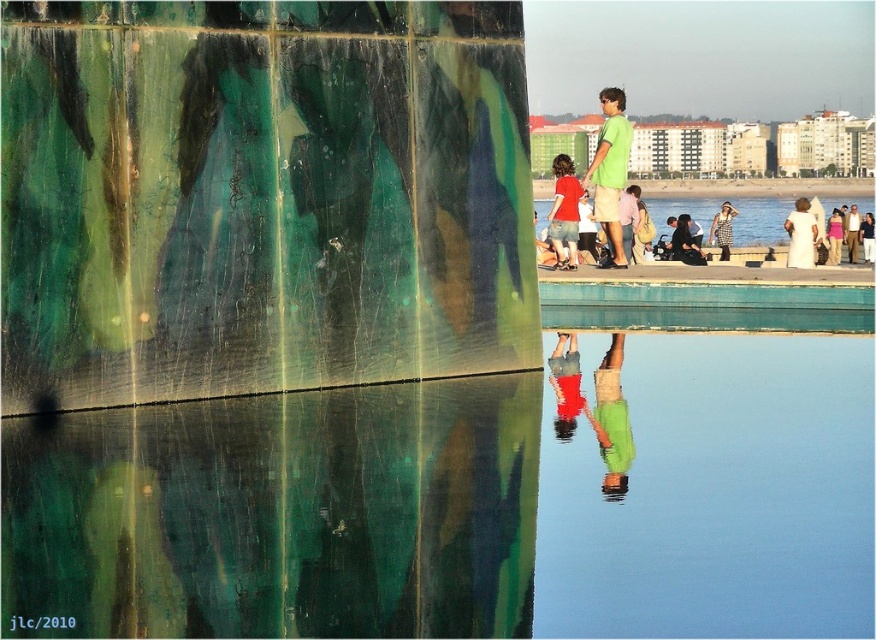
Question: Does transparent glass water at center appear on the right side of matte red shirt at center?

Choices:
 (A) yes
 (B) no

Answer: (A)

Question: Does transparent glass water at center appear under matte red shirt at center?

Choices:
 (A) no
 (B) yes

Answer: (B)

Question: Which point is farther to the camera?

Choices:
 (A) green matte shirt at upper center
 (B) transparent glass water at center
 (C) green marble legs at lower center

Answer: (A)

Question: Which point appears closest to the camera in this image?

Choices:
 (A) (583, 410)
 (B) (736, 216)

Answer: (A)

Question: Which is nearer to the matte red shirt at center?

Choices:
 (A) khaki cotton pants at center
 (B) green matte shirt at upper center

Answer: (B)

Question: Does green marble legs at lower center appear over white and black checkered dress at center?

Choices:
 (A) yes
 (B) no

Answer: (B)